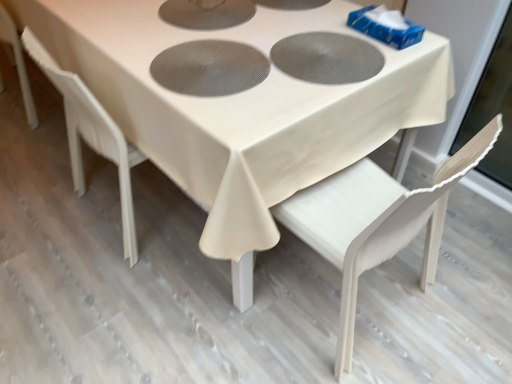
Question: Is the surface of white plastic chair at lower left, acting as the first chair starting from the left, in direct contact with white fabric table at center?

Choices:
 (A) yes
 (B) no

Answer: (B)

Question: From the image's perspective, is white plastic chair at lower left, arranged as the 2th chair when viewed from the right, over white fabric table at center?

Choices:
 (A) yes
 (B) no

Answer: (B)

Question: Does white plastic chair at lower left, arranged as the 2th chair when viewed from the right, appear on the right side of white fabric table at center?

Choices:
 (A) no
 (B) yes

Answer: (B)

Question: Is white plastic chair at lower left, acting as the first chair starting from the left, far from white fabric table at center?

Choices:
 (A) yes
 (B) no

Answer: (B)

Question: Does white plastic chair at lower left, arranged as the 2th chair when viewed from the right, come behind white fabric table at center?

Choices:
 (A) yes
 (B) no

Answer: (A)

Question: Looking at their shapes, would you say white plastic chair at lower left, acting as the first chair starting from the left, is wider or thinner than white fabric table at center?

Choices:
 (A) thin
 (B) wide

Answer: (A)

Question: Is white plastic chair at lower left, arranged as the 2th chair when viewed from the right, situated inside white fabric table at center or outside?

Choices:
 (A) inside
 (B) outside

Answer: (A)

Question: Considering the positions of point (87, 89) and point (153, 87), is point (87, 89) closer or farther from the camera than point (153, 87)?

Choices:
 (A) farther
 (B) closer

Answer: (A)

Question: Is white plastic chair at lower left, acting as the first chair starting from the left, bigger or smaller than white fabric table at center?

Choices:
 (A) small
 (B) big

Answer: (A)

Question: Is white matte chair at lower right, acting as the second chair starting from the left, wider or thinner than white plastic chair at lower left, acting as the first chair starting from the left?

Choices:
 (A) wide
 (B) thin

Answer: (B)

Question: From the image's perspective, is white matte chair at lower right, acting as the second chair starting from the left, positioned above or below white plastic chair at lower left, acting as the first chair starting from the left?

Choices:
 (A) below
 (B) above

Answer: (A)

Question: From a real-world perspective, relative to white plastic chair at lower left, arranged as the 2th chair when viewed from the right, is white matte chair at lower right, the 1th chair from the right, vertically above or below?

Choices:
 (A) below
 (B) above

Answer: (B)

Question: Considering the positions of point (302, 218) and point (61, 84), is point (302, 218) closer or farther from the camera than point (61, 84)?

Choices:
 (A) farther
 (B) closer

Answer: (B)

Question: From the image's perspective, is white fabric table at center positioned above or below white plastic chair at lower left, arranged as the 2th chair when viewed from the right?

Choices:
 (A) below
 (B) above

Answer: (B)

Question: Relative to white plastic chair at lower left, arranged as the 2th chair when viewed from the right, is white fabric table at center in front or behind?

Choices:
 (A) front
 (B) behind

Answer: (A)